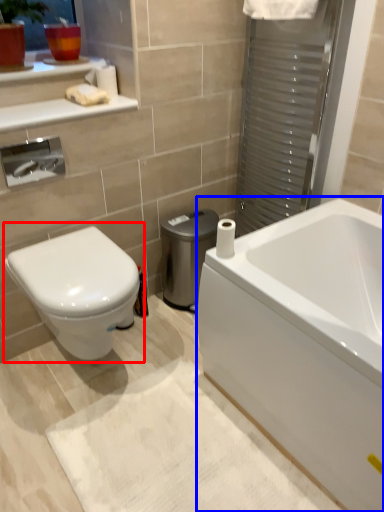
Question: Which object appears closest to the camera in this image, toilet (highlighted by a red box) or bathtub (highlighted by a blue box)?

Choices:
 (A) toilet
 (B) bathtub

Answer: (B)